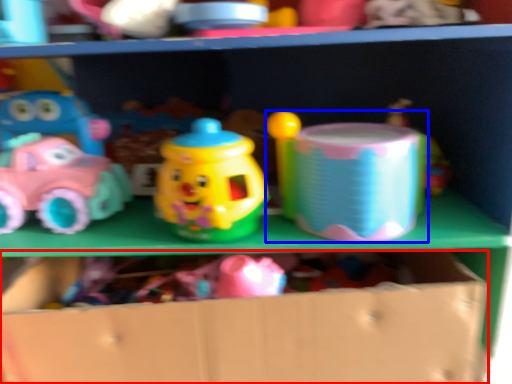
Question: Which object is closer to the camera taking this photo, cardboard box (highlighted by a red box) or toy (highlighted by a blue box)?

Choices:
 (A) cardboard box
 (B) toy

Answer: (A)